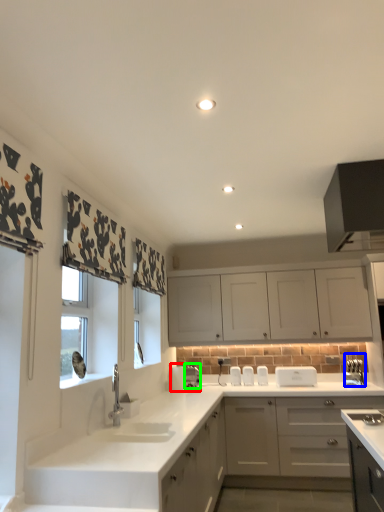
Question: Based on their relative distances, which object is nearer to appliance (highlighted by a red box)? Choose from appliance (highlighted by a blue box) and appliance (highlighted by a green box).

Choices:
 (A) appliance
 (B) appliance

Answer: (B)